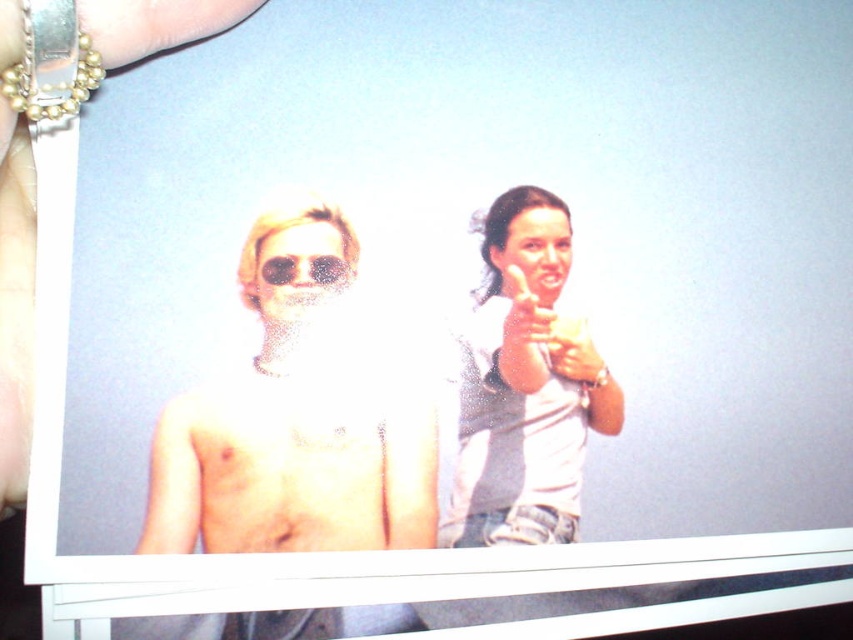
Is shiny metallic sunglasses at left smaller than matte plastic goggles at center?

Actually, shiny metallic sunglasses at left might be larger than matte plastic goggles at center.

Is point (355, 262) positioned before point (316, 256)?

No, (355, 262) is behind (316, 256).

Is point (212, 497) less distant than point (347, 262)?

Yes.

Locate an element on the screen. shiny metallic sunglasses at left is located at coordinates (294, 426).

Does shiny metallic sunglasses at left have a smaller size compared to white matte shirt at upper right?

No.

Does point (209, 472) lie in front of point (610, 396)?

Yes, it is.

Where is `shiny metallic sunglasses at left`? This screenshot has width=853, height=640. shiny metallic sunglasses at left is located at coordinates (294, 426).

Who is positioned more to the left, white matte shirt at upper right or matte sunglasses at center?

matte sunglasses at center is more to the left.

Between point (558, 276) and point (334, 278), which one is positioned in front?

Positioned in front is point (334, 278).

The height and width of the screenshot is (640, 853). What do you see at coordinates (525, 385) in the screenshot? I see `white matte shirt at upper right` at bounding box center [525, 385].

Locate an element on the screen. This screenshot has height=640, width=853. white matte shirt at upper right is located at coordinates (525, 385).